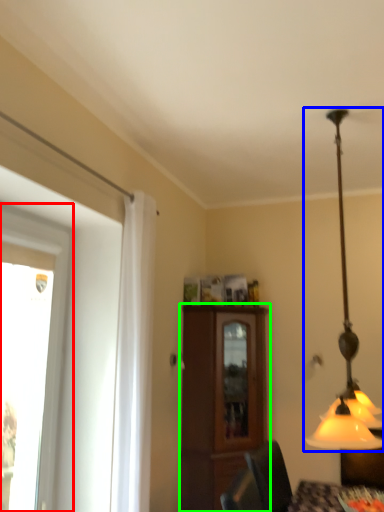
Question: Based on their relative distances, which object is farther from window (highlighted by a red box)? Choose from lamp (highlighted by a blue box) and cabinetry (highlighted by a green box).

Choices:
 (A) lamp
 (B) cabinetry

Answer: (A)